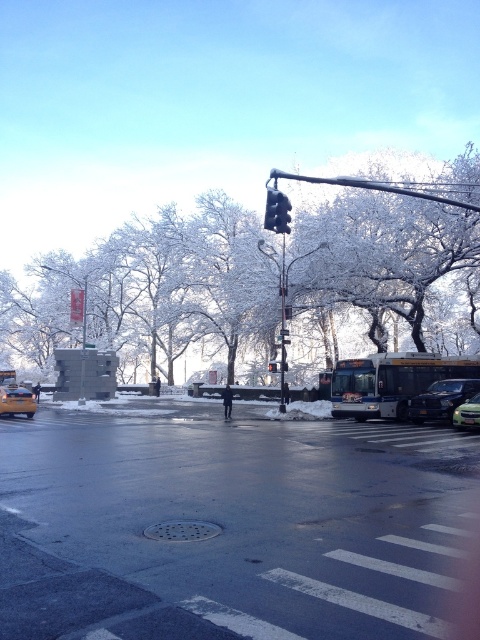
Between black glass traffic light at upper center and black glass traffic light at center, which one has more height?

black glass traffic light at upper center

Who is more forward, (277,211) or (275,371)?

Point (277,211) is in front.

This screenshot has height=640, width=480. Identify the location of black glass traffic light at upper center. (276, 211).

Is point (428, 531) farther from viewer compared to point (420, 406)?

No, it is in front of (420, 406).

This screenshot has height=640, width=480. I want to click on shiny black car at center, so click(x=228, y=524).

Is metallic silver sedan at center-right taller than black glass traffic light at center?

Yes.

Is point (420, 397) in front of point (268, 369)?

Yes.

Where is `metallic silver sedan at center-right`? metallic silver sedan at center-right is located at coordinates (441, 400).

Locate an element on the screen. The width and height of the screenshot is (480, 640). metallic silver sedan at center-right is located at coordinates (441, 400).